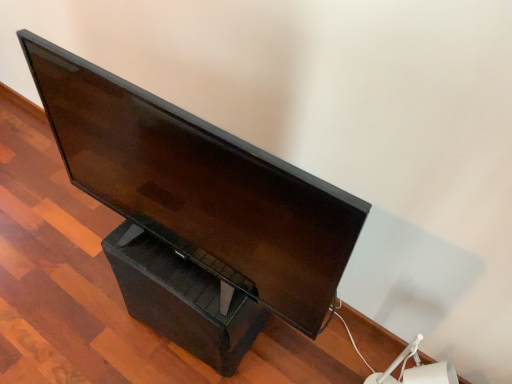
Question: In terms of width, does black plastic drawer at lower center look wider or thinner when compared to matte black monitor at center?

Choices:
 (A) wide
 (B) thin

Answer: (A)

Question: Does point (182, 324) appear closer or farther from the camera than point (132, 170)?

Choices:
 (A) closer
 (B) farther

Answer: (B)

Question: In the image, is black plastic drawer at lower center on the left side or the right side of matte black monitor at center?

Choices:
 (A) left
 (B) right

Answer: (A)

Question: From a real-world perspective, relative to black plastic drawer at lower center, is matte black monitor at center vertically above or below?

Choices:
 (A) above
 (B) below

Answer: (A)

Question: Would you say matte black monitor at center is inside or outside black plastic drawer at lower center?

Choices:
 (A) inside
 (B) outside

Answer: (B)

Question: Considering the relative positions of matte black monitor at center and black plastic drawer at lower center in the image provided, is matte black monitor at center to the left or to the right of black plastic drawer at lower center?

Choices:
 (A) right
 (B) left

Answer: (A)

Question: Based on their sizes in the image, would you say matte black monitor at center is bigger or smaller than black plastic drawer at lower center?

Choices:
 (A) small
 (B) big

Answer: (B)